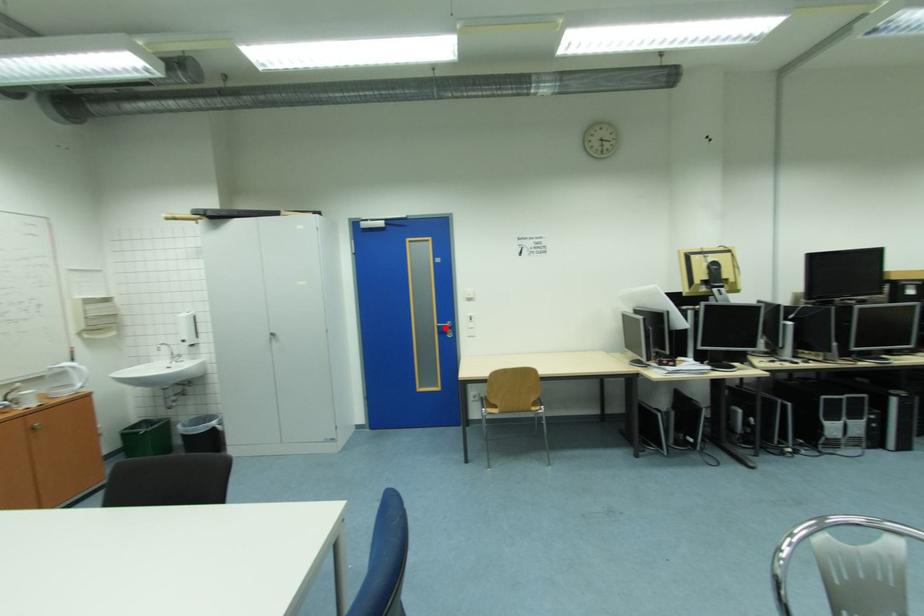
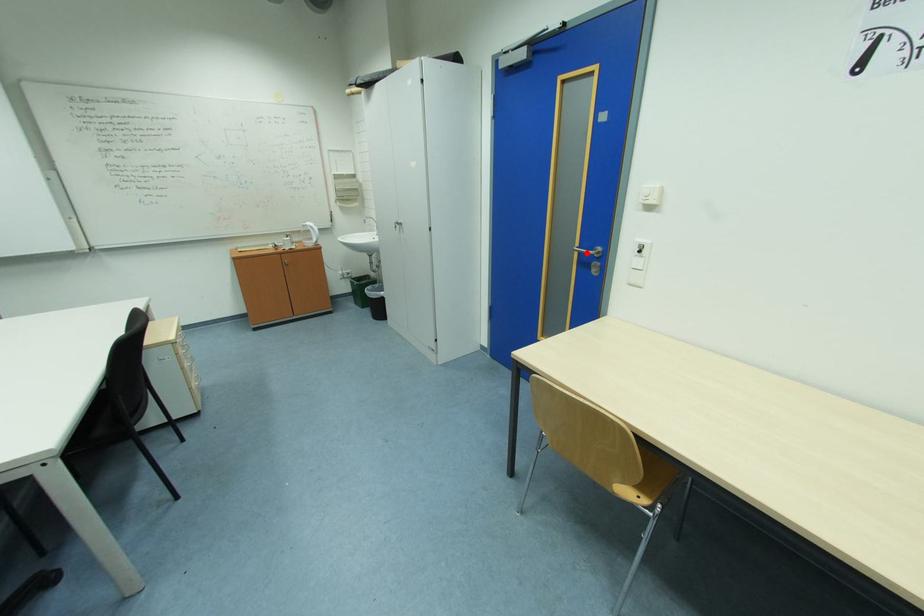
I am providing you with two images of the same scene from different viewpoints. A red point is marked on the first image and another point is marked on the second image. Do the highlighted points in image1 and image2 indicate the same real-world spot?

Yes